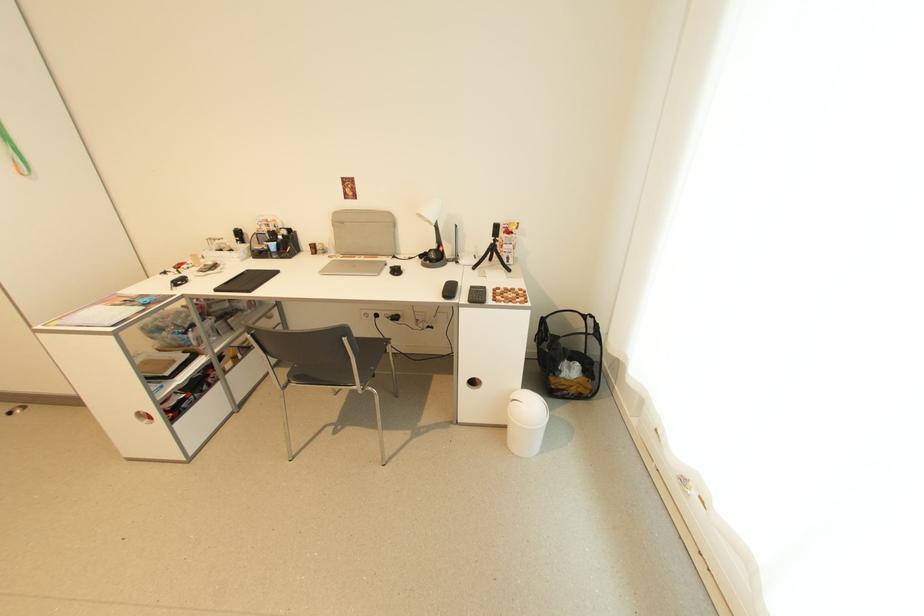
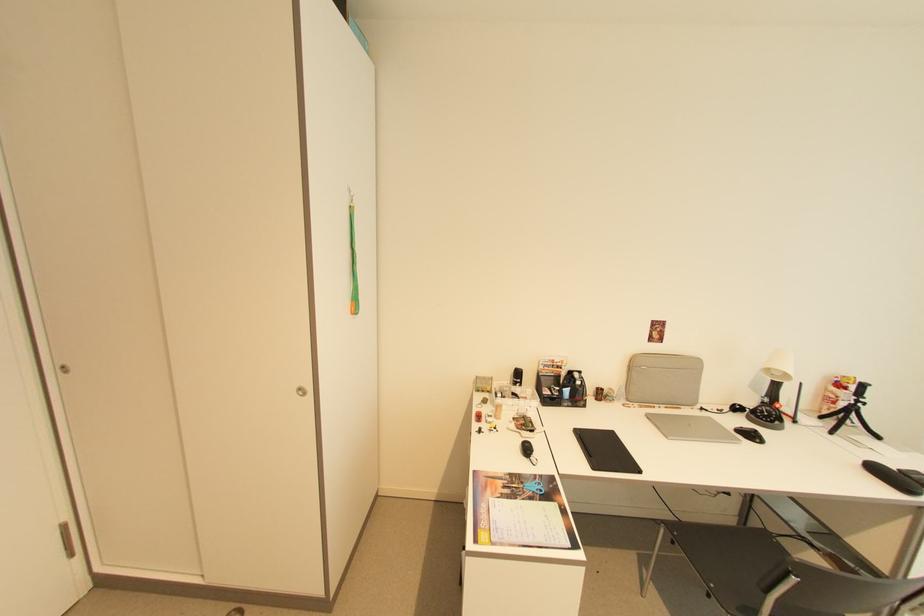
Question: The images are taken continuously from a first-person perspective. In which direction are you moving?

Choices:
 (A) Left
 (B) Right
 (C) Forward
 (D) Backward

Answer: (A)